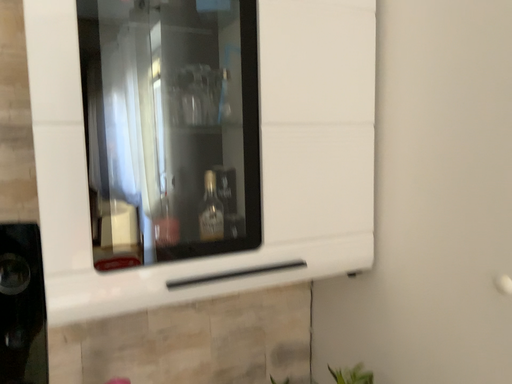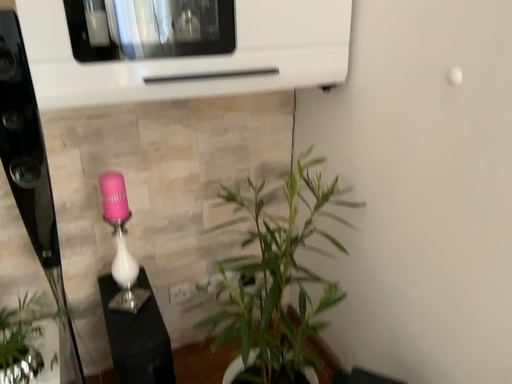
Question: How did the camera likely rotate when shooting the video?

Choices:
 (A) rotated upward
 (B) rotated downward

Answer: (B)